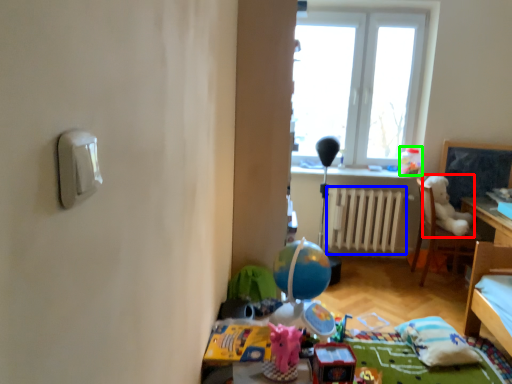
Question: Which is farther away from animal (highlighted by a red box)? radiator (highlighted by a blue box) or toy (highlighted by a green box)?

Choices:
 (A) radiator
 (B) toy

Answer: (A)